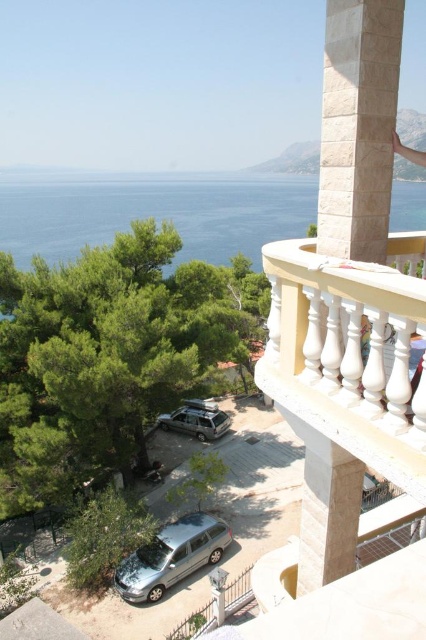
You are standing on the balcony and want to park your car in the parking area below. You see the silver metallic car at lower center and the satin silver suv at lower center. Which car is closer to the balcony railing?

The silver metallic car at lower center is closer to the balcony railing than the satin silver suv at lower center because it is positioned below it.